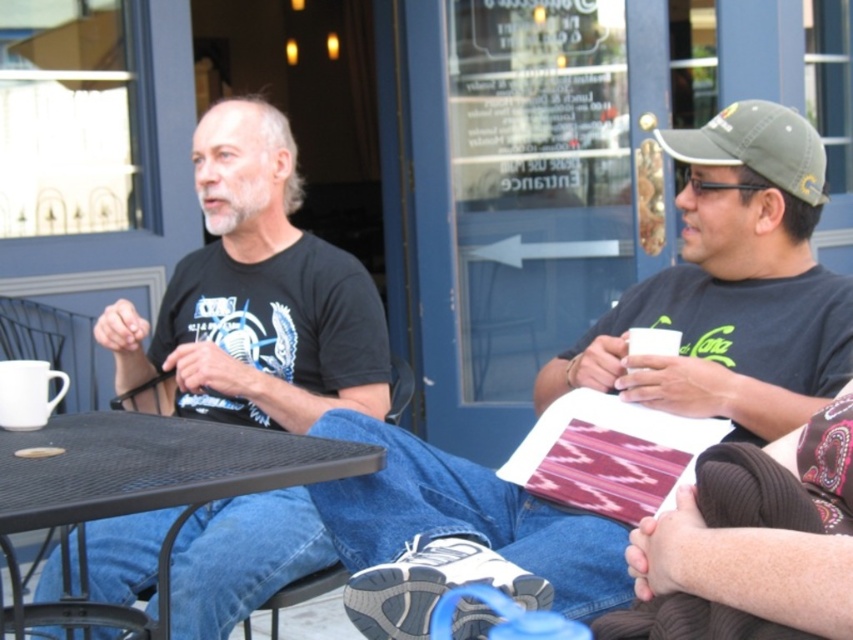
Question: Can you confirm if matte black t-shirt at center is bigger than black matte t-shirt at center?

Choices:
 (A) no
 (B) yes

Answer: (A)

Question: Does matte black t-shirt at center have a greater width compared to black mesh table at lower left?

Choices:
 (A) no
 (B) yes

Answer: (A)

Question: Among these objects, which one is farthest from the camera?

Choices:
 (A) black matte t-shirt at center
 (B) black mesh table at lower left

Answer: (A)

Question: Where is blue denim jeans at lower center located in relation to black mesh table at lower left in the image?

Choices:
 (A) below
 (B) above

Answer: (A)

Question: Which object is farther from the camera taking this photo?

Choices:
 (A) blue denim jeans at lower center
 (B) black mesh table at lower left
 (C) olive green fabric baseball cap at upper right

Answer: (C)

Question: Which point is farther to the camera?

Choices:
 (A) black matte t-shirt at center
 (B) olive green fabric baseball cap at upper right
 (C) black mesh table at lower left
 (D) matte black t-shirt at center

Answer: (A)